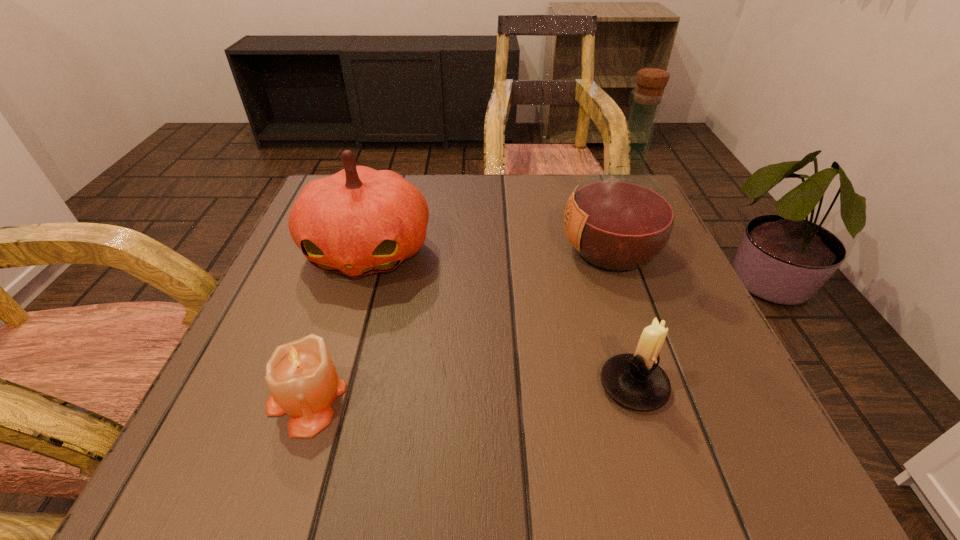
Locate an element on the screen. Image resolution: width=960 pixels, height=540 pixels. object situated at the far right corner is located at coordinates (619, 219).

Where is `object that is at the near right corner`? object that is at the near right corner is located at coordinates (636, 381).

Image resolution: width=960 pixels, height=540 pixels. In the image, there is a desktop. What are the coordinates of `vacant space at the far edge` in the screenshot? It's located at (478, 201).

The width and height of the screenshot is (960, 540). I want to click on vacant space at the near edge of the desktop, so pyautogui.click(x=593, y=427).

This screenshot has height=540, width=960. In the image, there is a desktop. In order to click on free space at the left edge in this screenshot , I will do `click(284, 295)`.

Where is `vacant space at the right edge of the desktop`? vacant space at the right edge of the desktop is located at coordinates (673, 256).

In the image, there is a desktop. Where is `free space at the far right corner`? free space at the far right corner is located at coordinates (588, 174).

Where is `vacant area that lies between the tallest object and the candle`? Image resolution: width=960 pixels, height=540 pixels. vacant area that lies between the tallest object and the candle is located at coordinates (458, 325).

Identify the location of unoccupied position between the liquor and the second tallest object. (489, 251).

I want to click on free spot between the candle holder and the liquor, so click(622, 319).